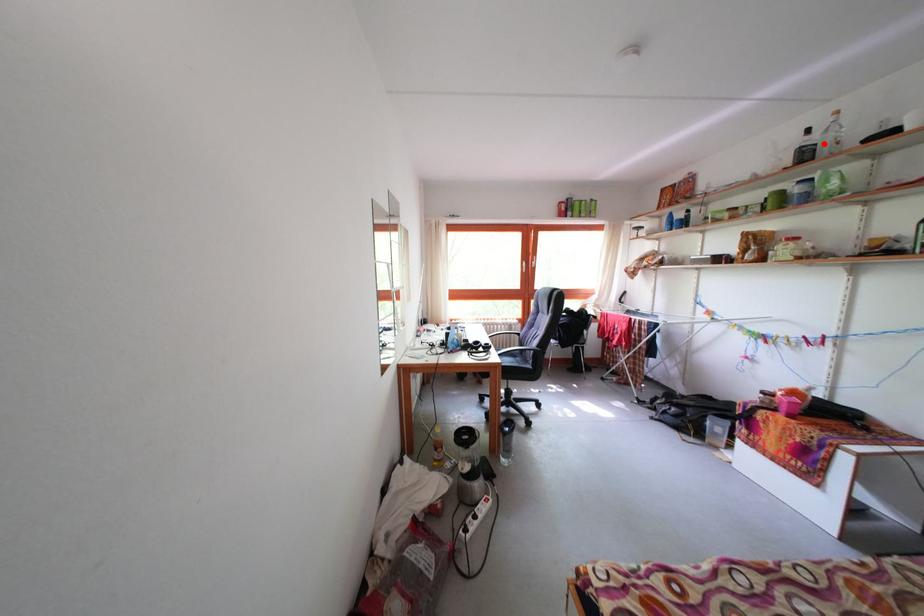
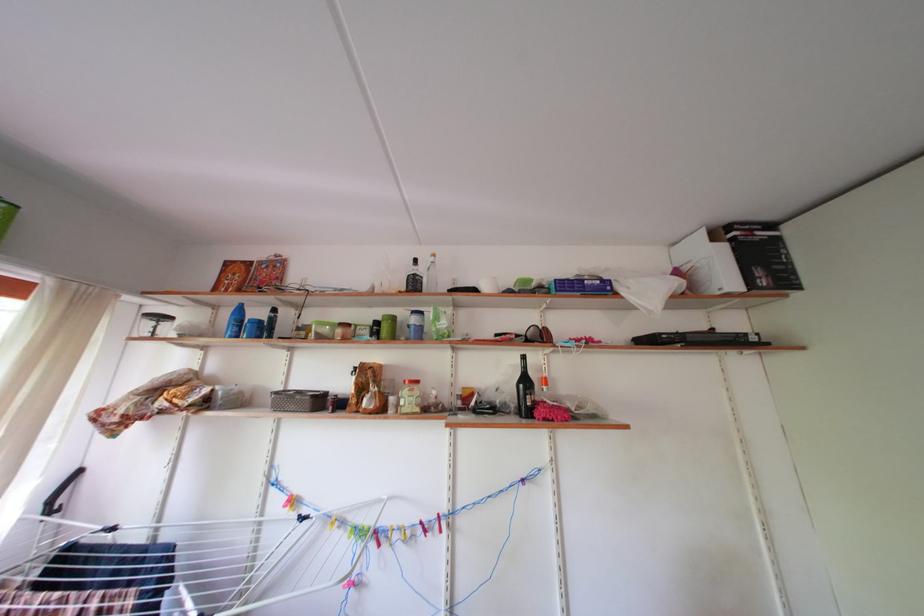
Find the pixel in the second image that matches the highlighted location in the first image.

(430, 276)